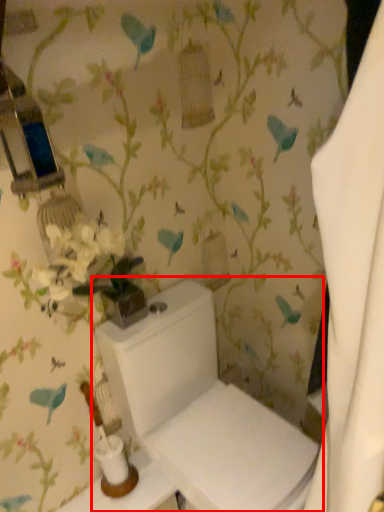
Question: From the image's perspective, considering the relative positions of toilet (annotated by the red box) and table in the image provided, where is toilet (annotated by the red box) located with respect to the staircase?

Choices:
 (A) above
 (B) below

Answer: (A)